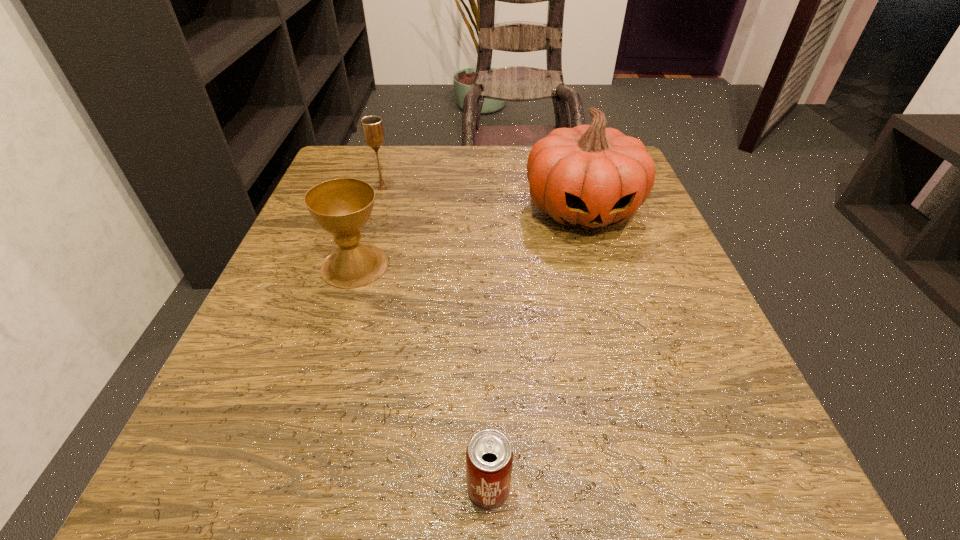
Find the location of a particular element. The image size is (960, 540). empty space between the pumpkin and the nearer chalice is located at coordinates (468, 238).

The image size is (960, 540). I want to click on object that is the second closest to the rightmost object, so click(372, 127).

The image size is (960, 540). In order to click on object that is the closest one to the rightmost object in this screenshot , I will do `click(342, 207)`.

Image resolution: width=960 pixels, height=540 pixels. What are the coordinates of `free spot that satisfies the following two spatial constraints: 1. on the front side of the farther chalice; 2. on the right side of the shortest object` in the screenshot? It's located at (292, 489).